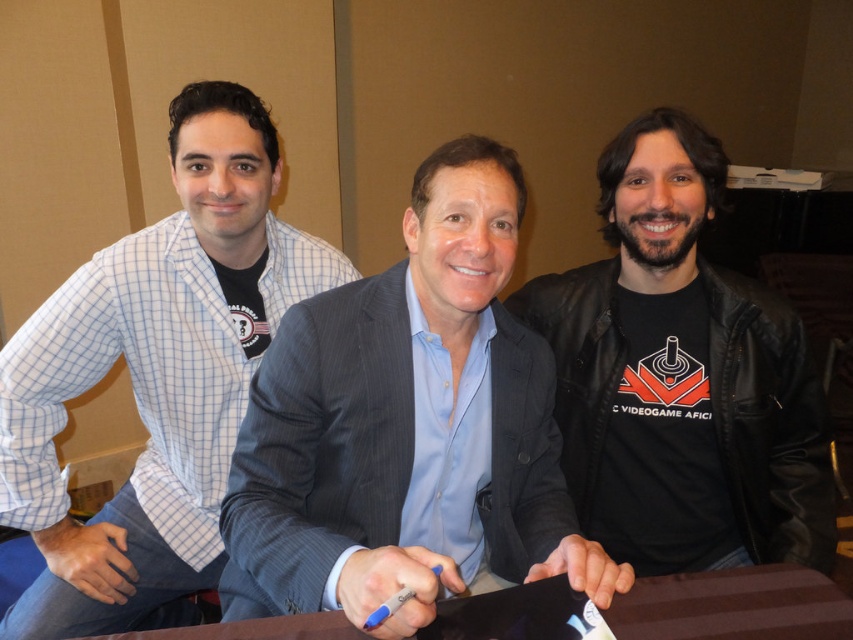
Can you confirm if blue shirt at center is bigger than blue plastic pen at center?

Correct, blue shirt at center is larger in size than blue plastic pen at center.

Which is below, blue shirt at center or blue plastic pen at center?

Positioned lower is blue plastic pen at center.

Where is `blue shirt at center`? This screenshot has width=853, height=640. blue shirt at center is located at coordinates (407, 426).

Is black leather jacket at right thinner than blue plastic pen at center?

No.

Is black leather jacket at right to the left of blue plastic pen at center from the viewer's perspective?

No, black leather jacket at right is not to the left of blue plastic pen at center.

Which is in front, point (833, 499) or point (396, 593)?

Point (396, 593) is in front.

Locate an element on the screen. The image size is (853, 640). black leather jacket at right is located at coordinates coord(682,376).

How distant is black leather jacket at right from brown wooden table at center?

42.71 centimeters

Looking at this image, does black leather jacket at right have a smaller size compared to brown wooden table at center?

No, black leather jacket at right is not smaller than brown wooden table at center.

I want to click on black leather jacket at right, so click(x=682, y=376).

At what (x,y) coordinates should I click in order to perform the action: click on black leather jacket at right. Please return your answer as a coordinate pair (x, y). This screenshot has width=853, height=640. Looking at the image, I should click on (682, 376).